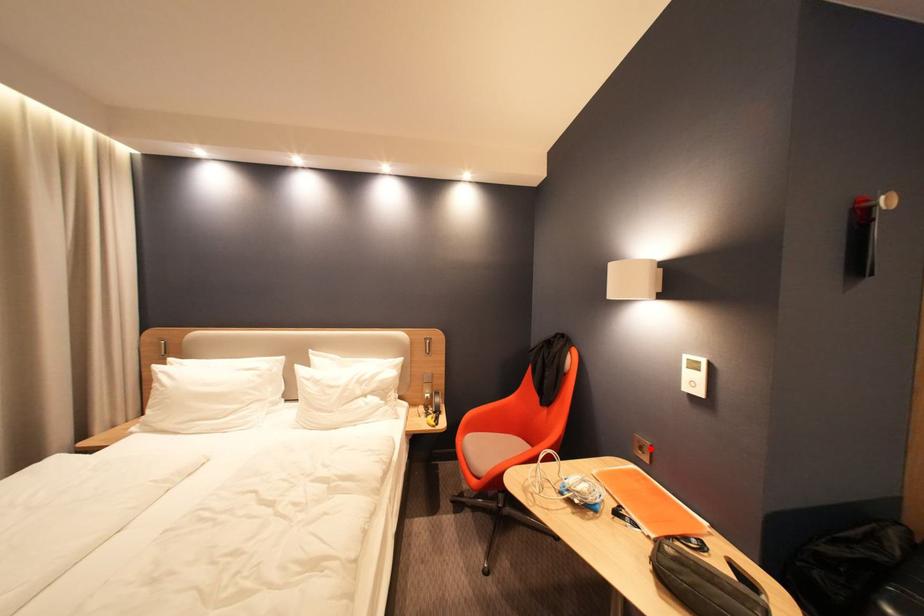
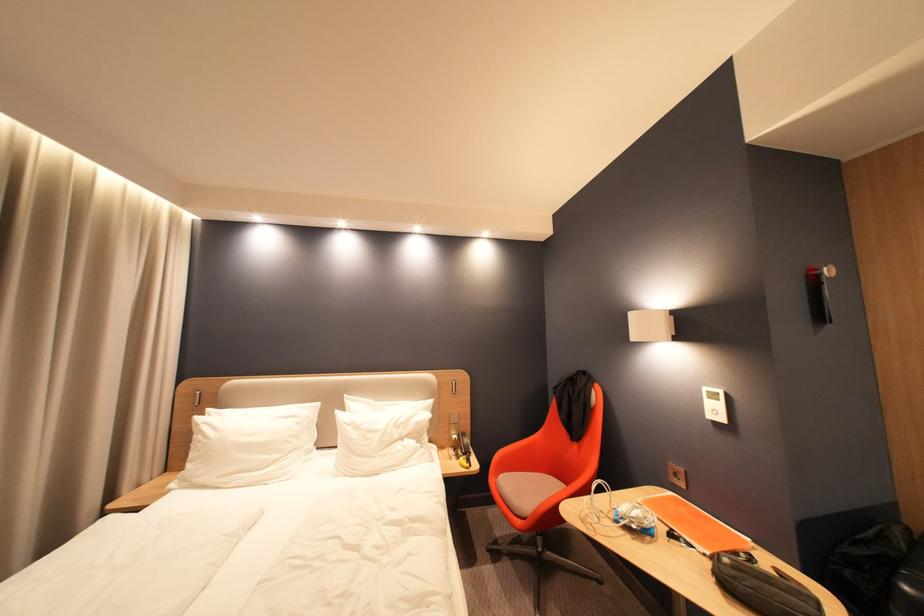
Find the pixel in the second image that matches the highlighted location in the first image.

(686, 476)